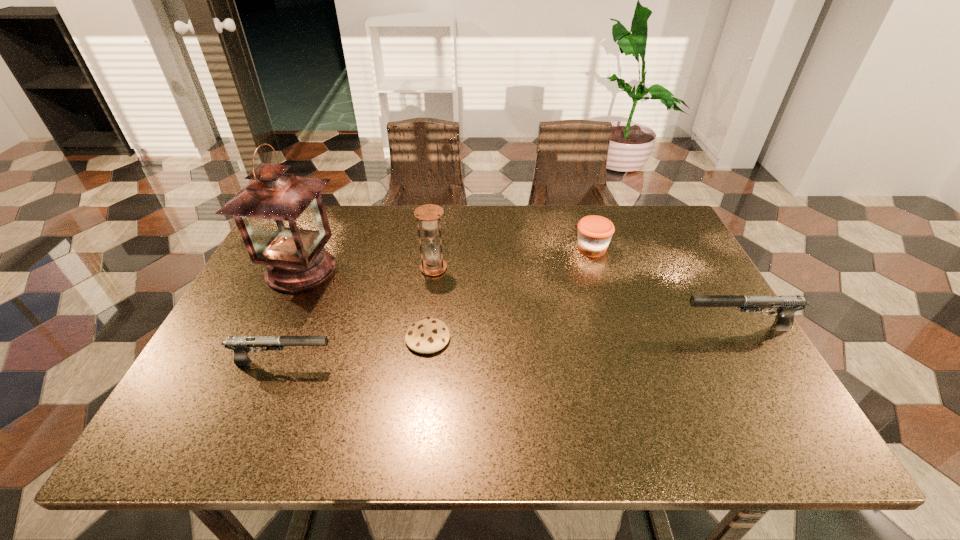
Please point a spot to place another gun for symmetrical spacing. Please provide its 2D coordinates. Your answer should be formatted as a tuple, i.e. [(x, y)], where the tuple contains the x and y coordinates of a point satisfying the conditions above.

[(519, 344)]